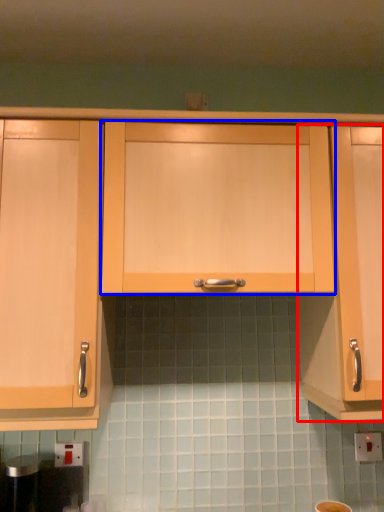
Question: Among these objects, which one is nearest to the camera, cabinetry (highlighted by a red box) or cabinetry (highlighted by a blue box)?

Choices:
 (A) cabinetry
 (B) cabinetry

Answer: (B)